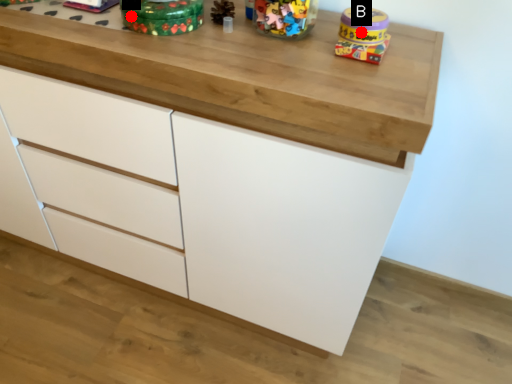
Question: Two points are circled on the image, labeled by A and B beside each circle. Among these points, which one is farthest from the camera?

Choices:
 (A) A is further
 (B) B is further

Answer: (A)